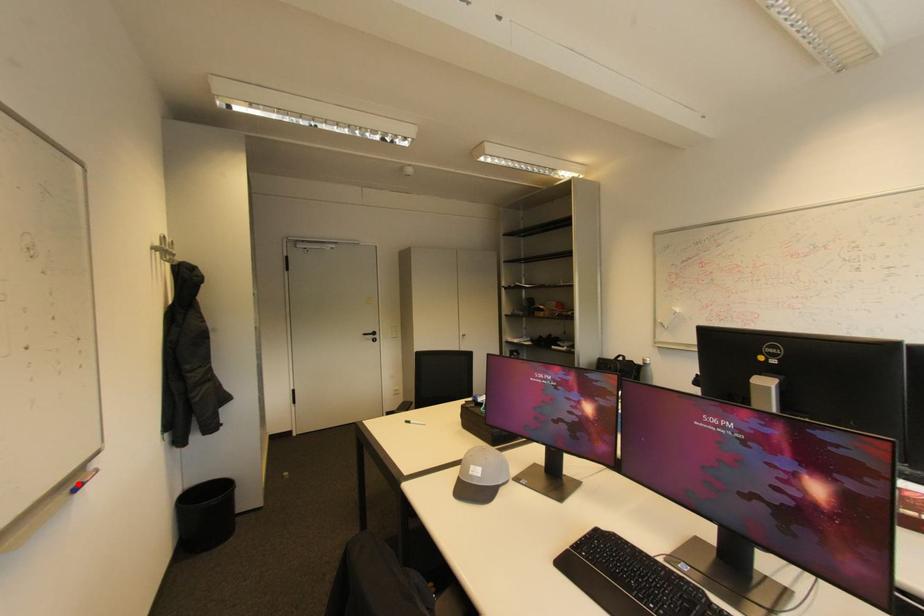
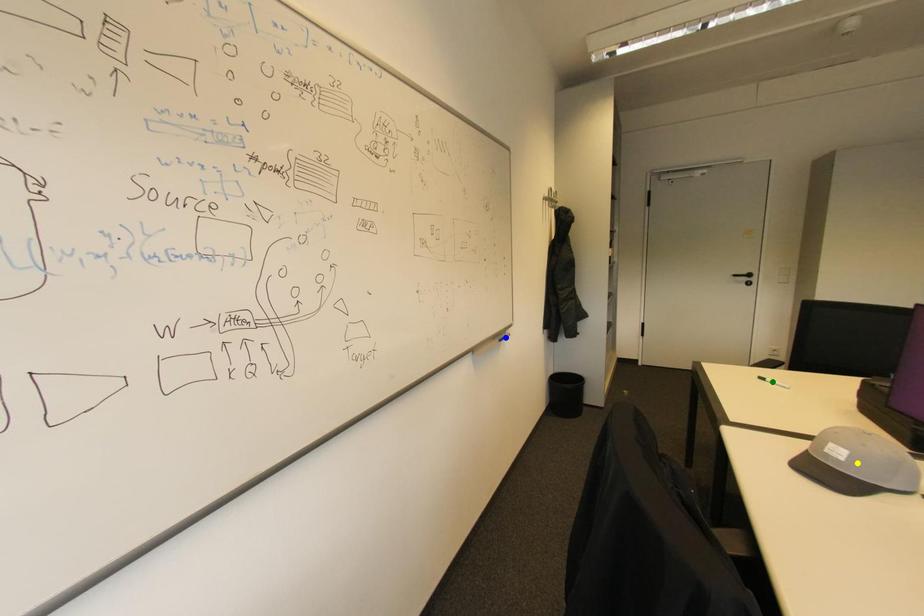
Question: I am providing you with two images of the same scene from different viewpoints. A red point is marked on the first image. You are given multiple points on the second image. Can you choose the point in image 2 that corresponds to the point in image 1?

Choices:
 (A) blue point
 (B) green point
 (C) yellow point

Answer: (A)